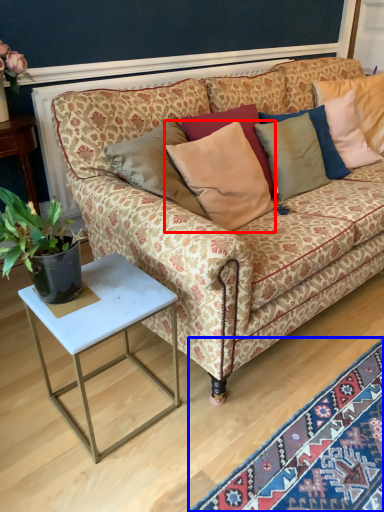
Question: Which of the following is the farthest to the observer, pillow (highlighted by a red box) or mat (highlighted by a blue box)?

Choices:
 (A) pillow
 (B) mat

Answer: (A)